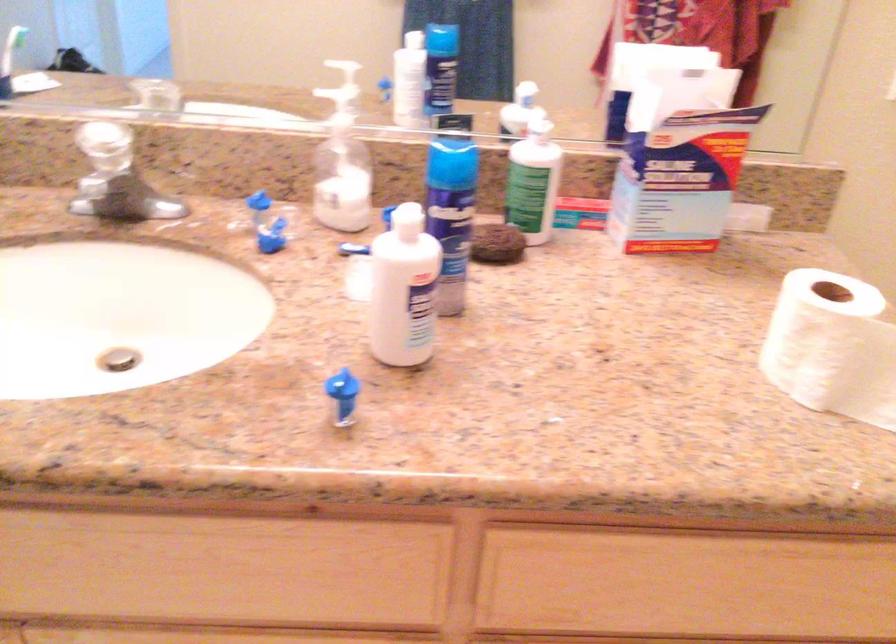
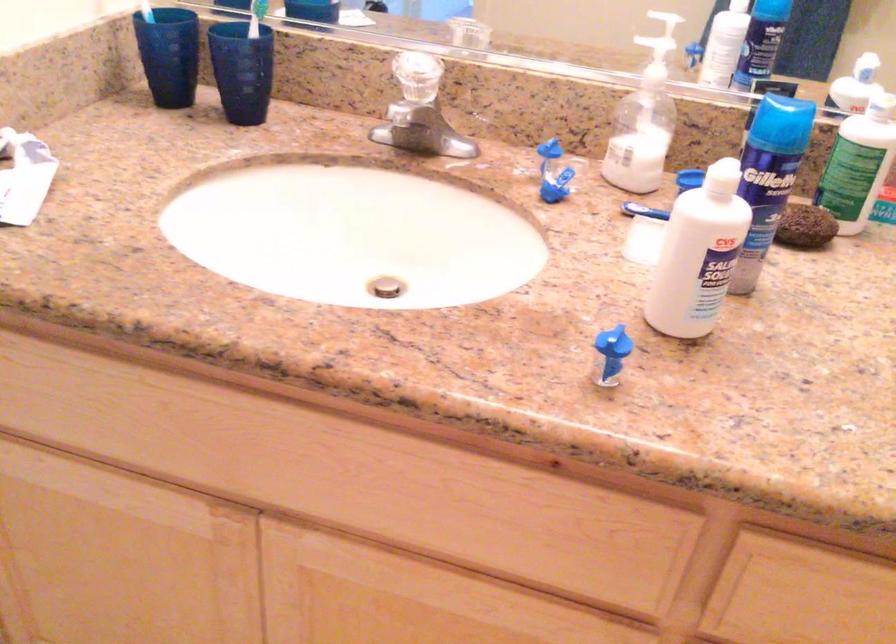
Question: The images are taken continuously from a first-person perspective. In which direction is your viewpoint rotating?

Choices:
 (A) Left
 (B) Right
 (C) Up
 (D) Down

Answer: (A)